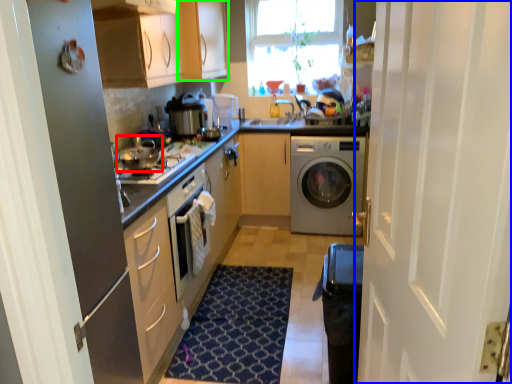
Question: Based on their relative distances, which object is farther from appliance (highlighted by a red box)? Choose from door (highlighted by a blue box) and cabinetry (highlighted by a green box).

Choices:
 (A) door
 (B) cabinetry

Answer: (A)